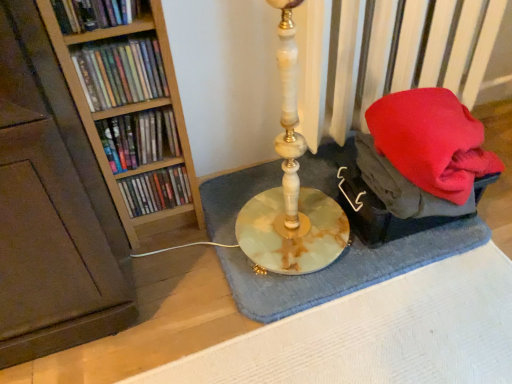
Question: Is blue textured bath mat at center bigger or smaller than matte plastic books at left, positioned as the first book in bottom-to-top order?

Choices:
 (A) small
 (B) big

Answer: (B)

Question: Based on their positions, is blue textured bath mat at center located to the left or right of matte plastic books at left, the fourth book viewed from the top?

Choices:
 (A) right
 (B) left

Answer: (A)

Question: Which object is positioned farthest from the matte plastic books at left, positioned as the first book in bottom-to-top order?

Choices:
 (A) matte plastic books at left, which is the second book from bottom to top
 (B) matte plastic books at left, which is the 2th book from top to bottom
 (C) blue textured bath mat at center
 (D) matte plastic book at upper left, marked as the first book in a top-to-bottom arrangement

Answer: (D)

Question: Estimate the real-world distances between objects in this image. Which object is closer to the matte plastic book at upper left, the 4th book from the bottom?

Choices:
 (A) blue textured bath mat at center
 (B) matte plastic books at left, positioned as the first book in bottom-to-top order
 (C) matte plastic books at left, which is the 2th book from top to bottom
 (D) matte plastic books at left, positioned as the 3th book in top-to-bottom order

Answer: (C)